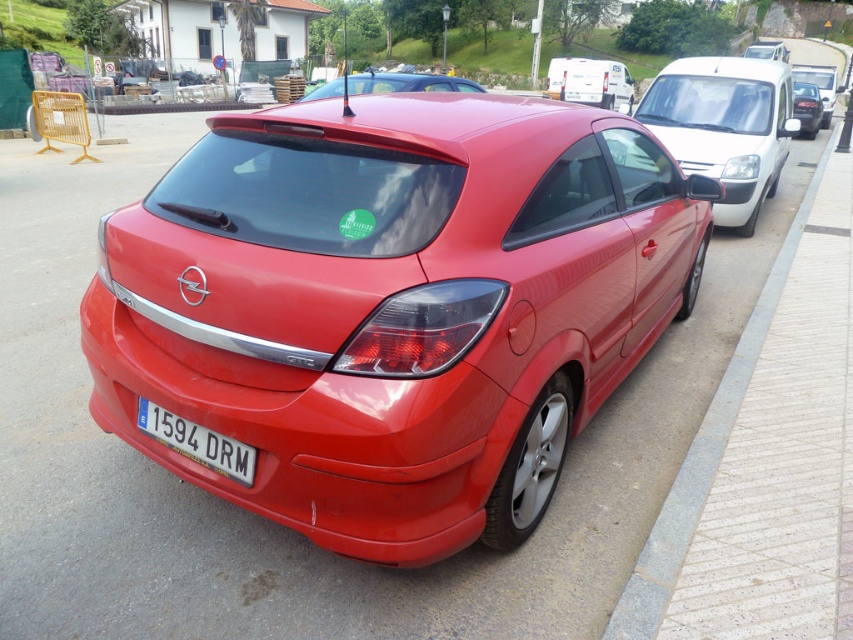
You are a delivery driver who needs to park your vehicle behind the red Opel Astra GTC. You have two options for parking spots near the white glossy van at upper right and the glossy metallic van at upper right. Which parking spot would allow your vehicle to fit better based on the width of the vans?

The white glossy van at upper right is thinner than the glossy metallic van at upper right, so the parking spot near the white glossy van at upper right would provide more space for your vehicle to fit better.

You are a parking sensor system that needs to determine if there is enough space between the gray concrete curb at lower right and the white plastic license plate at center to fit a 1.2 meter wide object. Can you confirm if there is enough space?

The gray concrete curb at lower right is bigger than the white plastic license plate at center, but the exact distance between them is not provided. Therefore, it is impossible to determine if a 1.2 meter wide object can fit between them based on the given information.

You are a driver trying to park your car in a parking spot that has a gray concrete curb at lower right and a white plastic license plate at center. Which object should you avoid hitting when backing up?

You should avoid hitting the gray concrete curb at lower right because the white plastic license plate at center is behind it and closer to your car when backing up.